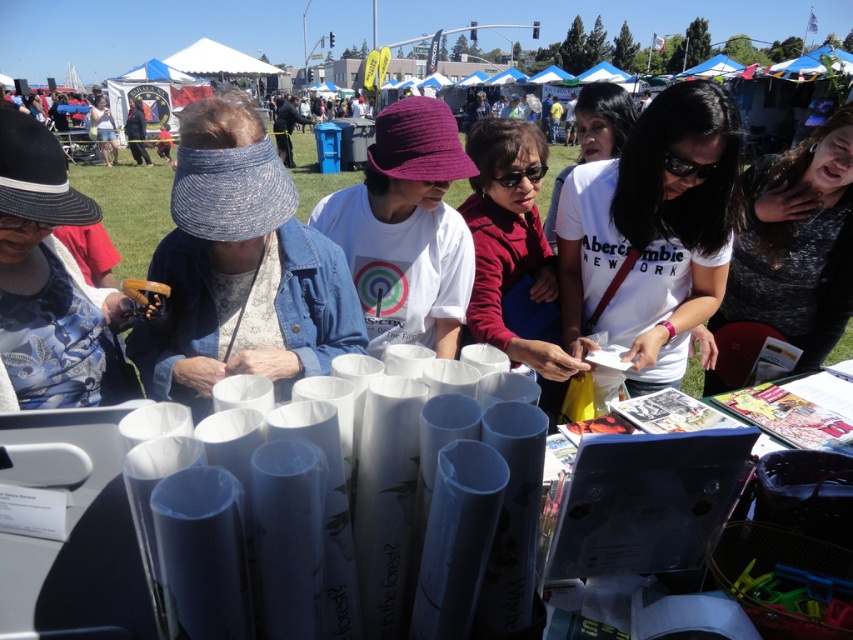
Which is below, matte red shirt at center or white cotton shirt at center?

matte red shirt at center is below.

Who is more forward, (x=503, y=273) or (x=618, y=144)?

Point (x=503, y=273) is in front.

This screenshot has width=853, height=640. What are the coordinates of `matte red shirt at center` in the screenshot? It's located at (514, 253).

At what (x,y) coordinates should I click in order to perform the action: click on white paper at center. Please return your answer as a coordinate pair (x, y). Image resolution: width=853 pixels, height=640 pixels. Looking at the image, I should click on (796, 244).

Which is more to the right, white paper at center or white cotton shirt at center?

Positioned to the right is white paper at center.

Find the location of a particular element. white paper at center is located at coordinates (796, 244).

Find the location of a particular element. white paper at center is located at coordinates (796, 244).

Is point (572, 348) behind point (102, 531)?

Yes, it is behind point (102, 531).

Between white matte shirt at center and white paper rolls at center, which one appears on the right side from the viewer's perspective?

From the viewer's perspective, white matte shirt at center appears more on the right side.

Identify the location of white matte shirt at center. The image size is (853, 640). (x=653, y=232).

Locate an element on the screen. This screenshot has height=640, width=853. white matte shirt at center is located at coordinates (653, 232).